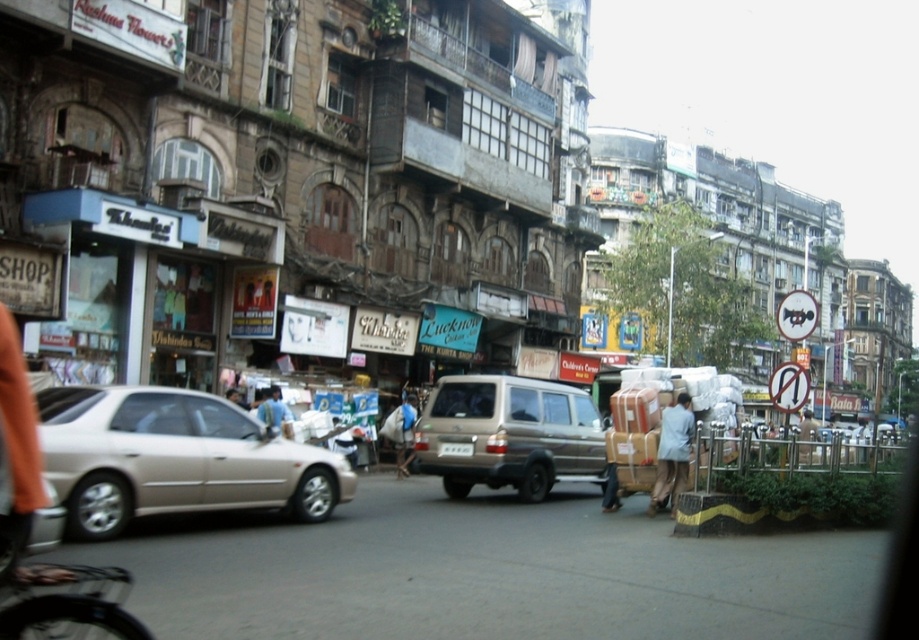
Question: Which object is the farthest from the light brown fabric jacket at lower right?

Choices:
 (A) blue fabric bag at center
 (B) matte beige sedan at left
 (C) blue cotton shirt at center
 (D) light blue shirt at center

Answer: (A)

Question: Can you confirm if blue fabric bag at center is positioned to the right of blue cotton shirt at center?

Choices:
 (A) no
 (B) yes

Answer: (B)

Question: Does matte beige sedan at left appear on the left side of blue cotton shirt at center?

Choices:
 (A) yes
 (B) no

Answer: (B)

Question: Which is farther from the blue cotton shirt at center?

Choices:
 (A) blue fabric bag at center
 (B) light brown fabric jacket at lower right
 (C) gold metallic van at center
 (D) matte beige sedan at left

Answer: (B)

Question: Which of the following is the farthest from the observer?

Choices:
 (A) light brown fabric jacket at lower right
 (B) blue fabric bag at center
 (C) blue cotton shirt at center
 (D) matte beige sedan at left

Answer: (B)

Question: Is gold metallic van at center below light blue shirt at center?

Choices:
 (A) yes
 (B) no

Answer: (B)